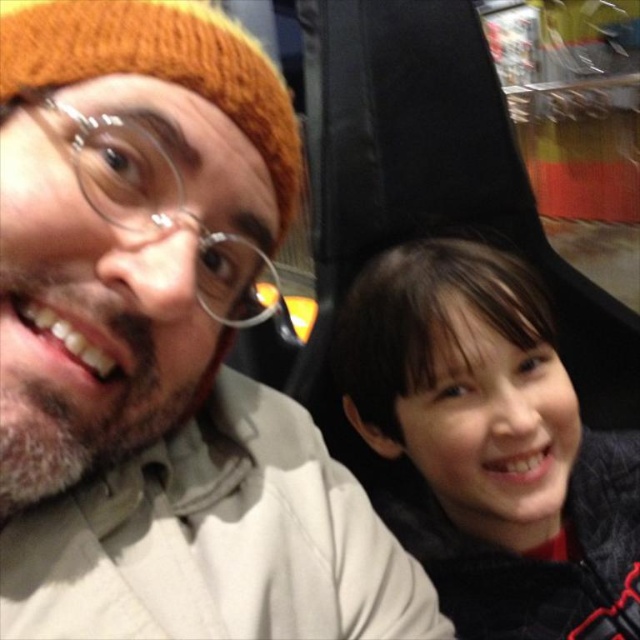
Question: Which of the following is the farthest from the observer?

Choices:
 (A) (406, 380)
 (B) (88, 536)

Answer: (A)

Question: Is the position of knitted wool hat at upper left more distant than that of dark brown hair at right?

Choices:
 (A) no
 (B) yes

Answer: (A)

Question: Which point is farther from the camera taking this photo?

Choices:
 (A) (109, 502)
 (B) (346, 300)

Answer: (B)

Question: Where is knitted wool hat at upper left located in relation to dark brown hair at right in the image?

Choices:
 (A) above
 (B) below

Answer: (A)

Question: Can you confirm if knitted wool hat at upper left is positioned above dark brown hair at right?

Choices:
 (A) yes
 (B) no

Answer: (A)